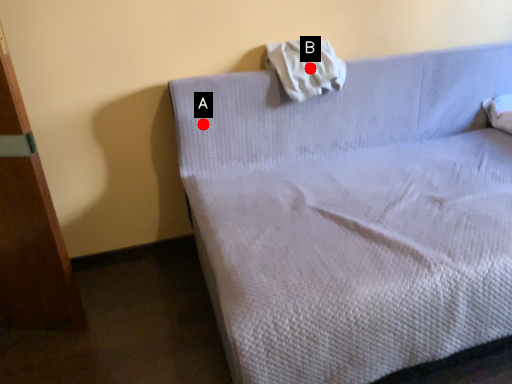
Question: Two points are circled on the image, labeled by A and B beside each circle. Which point is closer to the camera?

Choices:
 (A) A is closer
 (B) B is closer

Answer: (A)